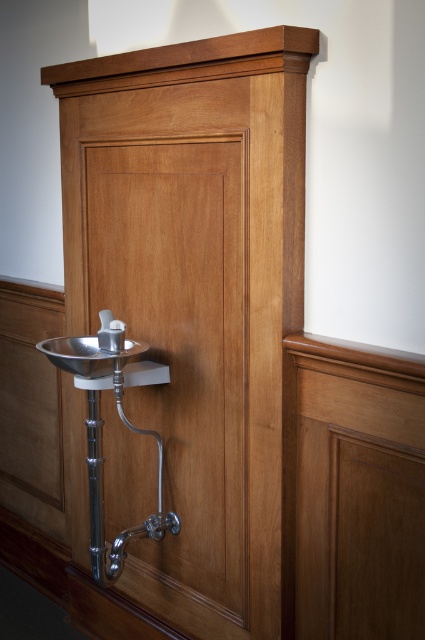
Question: Which point appears closest to the camera in this image?

Choices:
 (A) (59, 365)
 (B) (110, 342)

Answer: (B)

Question: Is polished stainless steel sink at lower left smaller than polished chrome faucet at center?

Choices:
 (A) yes
 (B) no

Answer: (B)

Question: Which of the following is the farthest from the observer?

Choices:
 (A) polished chrome faucet at center
 (B) polished stainless steel sink at lower left

Answer: (A)

Question: Can you confirm if polished stainless steel sink at lower left is positioned to the right of polished chrome faucet at center?

Choices:
 (A) yes
 (B) no

Answer: (B)

Question: Is polished stainless steel sink at lower left behind polished chrome faucet at center?

Choices:
 (A) yes
 (B) no

Answer: (B)

Question: Which object appears closest to the camera in this image?

Choices:
 (A) polished stainless steel sink at lower left
 (B) polished chrome faucet at center

Answer: (A)